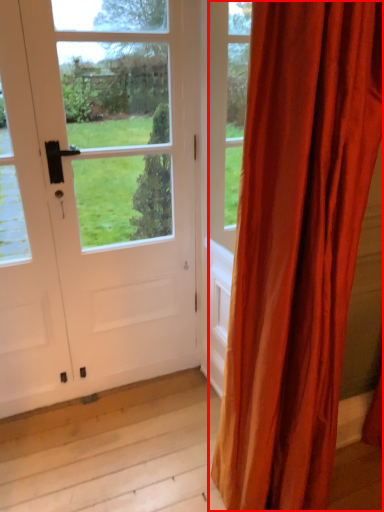
Question: Observing the image, what is the correct spatial positioning of curtain (annotated by the red box) in reference to door?

Choices:
 (A) left
 (B) right

Answer: (B)